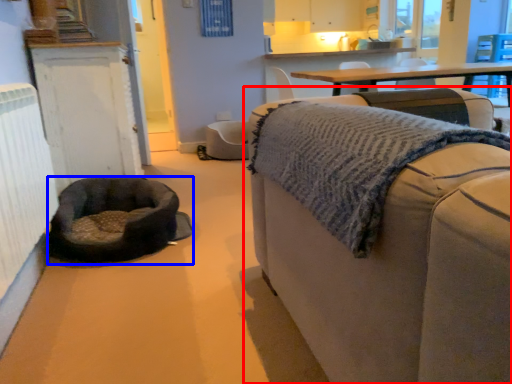
Question: Which of the following is the closest to the observer, studio couch (highlighted by a red box) or dog bed (highlighted by a blue box)?

Choices:
 (A) studio couch
 (B) dog bed

Answer: (A)